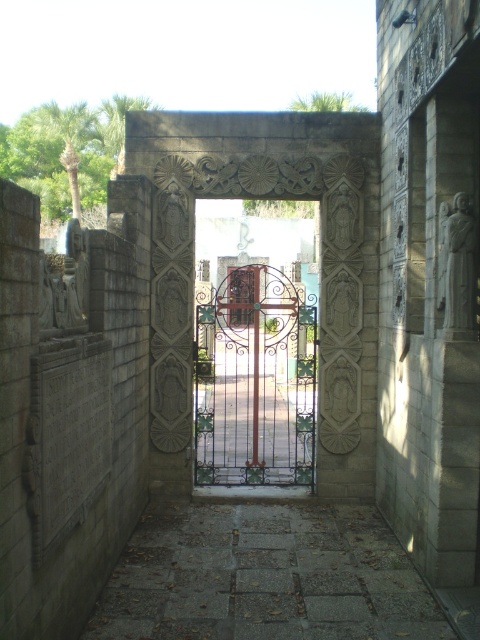
You are a visitor approaching the cemetery and need to pass through the entrance. The carved stone archway at center and the metallic wrought iron gate at center are in your path. Which structure will you encounter first as you approach?

The carved stone archway at center is smaller in size compared to the metallic wrought iron gate at center, so you will encounter the metallic wrought iron gate at center first since it is larger and likely positioned closer to the entrance path.

From the picture: You are standing in front of the carved stone archway at center. If you want to walk through it, which direction should you move relative to the archway?

The carved stone archway at center is located at point (320, 266), so you should move forward towards the archway to walk through it.

You are a visitor approaching the cemetery and want to enter through the entrance. Which object must you pass through first, the carved stone archway at center or the metallic wrought iron gate at center?

You must pass through the carved stone archway at center first because the metallic wrought iron gate at center is behind it.